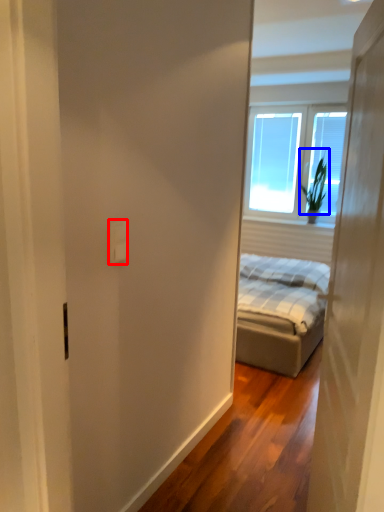
Question: Among these objects, which one is farthest to the camera, electric outlet (highlighted by a red box) or plant (highlighted by a blue box)?

Choices:
 (A) electric outlet
 (B) plant

Answer: (B)